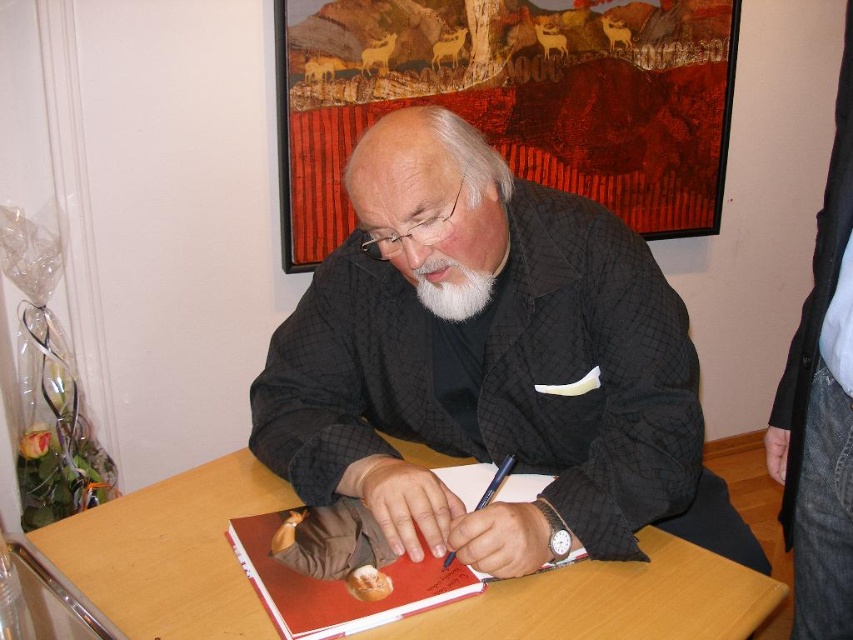
You are a photographer taking a portrait of the man in the scene. You notice the black textured jacket at center and the white fuzzy beard at center. Which object should you focus on first if you want to capture both in the same frame without adjusting your camera angle?

The black textured jacket at center is located below the white fuzzy beard at center, so you should focus on the white fuzzy beard at center first to ensure both are in frame without adjusting the camera angle.

You are a photographer at a book signing event. You need to capture a clear photo of the red matte notebook at center without the black textured jacket at center blocking it. Is this possible given their current positions?

The black textured jacket at center is positioned over the red matte notebook at center, so it is blocking it. To capture a clear photo of the red matte notebook at center without the black textured jacket at center, you would need to adjust their positions or angle the camera to avoid the jacket.